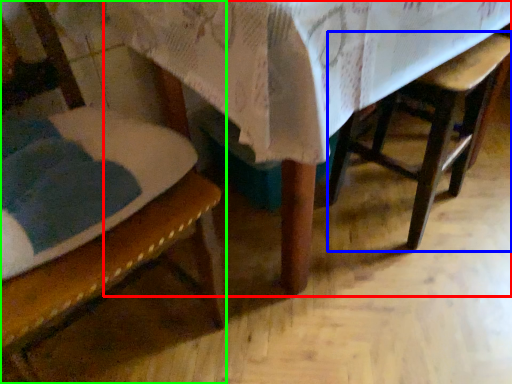
Question: Based on their relative distances, which object is nearer to table (highlighted by a red box)? Choose from armchair (highlighted by a blue box) and chair (highlighted by a green box).

Choices:
 (A) armchair
 (B) chair

Answer: (B)